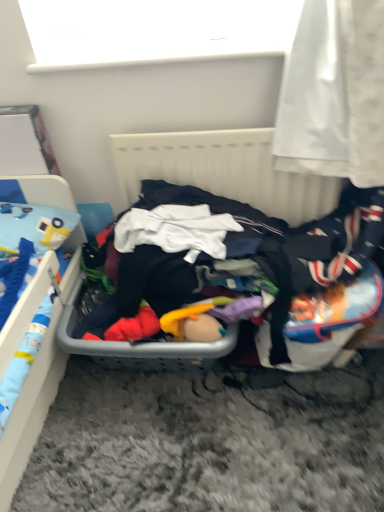
Question: From a real-world perspective, is white matte window screen at upper center positioned above or below blue plastic bed at left?

Choices:
 (A) above
 (B) below

Answer: (A)

Question: Looking at their shapes, would you say white matte window screen at upper center is wider or thinner than blue plastic bed at left?

Choices:
 (A) thin
 (B) wide

Answer: (A)

Question: Which of these objects is positioned farthest from the blue plastic bed at left?

Choices:
 (A) white plastic radiator at center
 (B) white matte window screen at upper center
 (C) dark fabric clothes at center

Answer: (B)

Question: Estimate the real-world distances between objects in this image. Which object is closer to the white matte window screen at upper center?

Choices:
 (A) white plastic radiator at center
 (B) blue plastic bed at left
 (C) dark fabric clothes at center

Answer: (A)